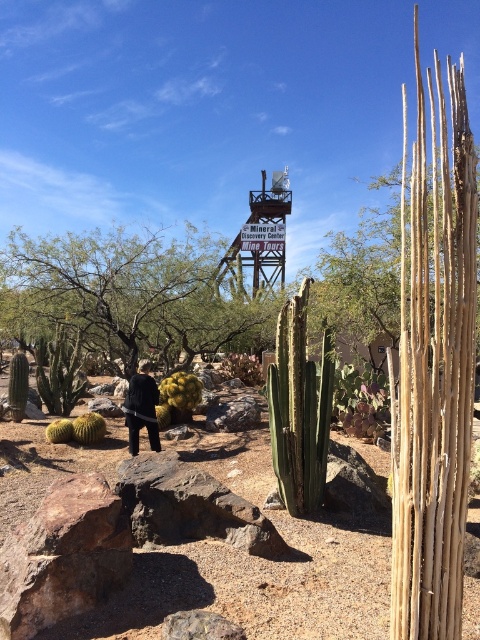
You are a photographer trying to capture a photo of the green fuzzy cactus at lower left and the black matte jacket at center. Which object should you focus on first to ensure both are in sharp focus?

You should focus on the black matte jacket at center first because it is closer to the viewer than the green fuzzy cactus at lower left, so adjusting focus from near to far will help both be in sharp focus.

You are a photographer trying to capture a wide shot of the desert scene. You notice the black matte jacket at center and the green spiny cactus at lower left. Based on their sizes, which object would appear smaller in the photo?

The black matte jacket at center would appear smaller in the photo because its width is less than the green spiny cactus at lower left.